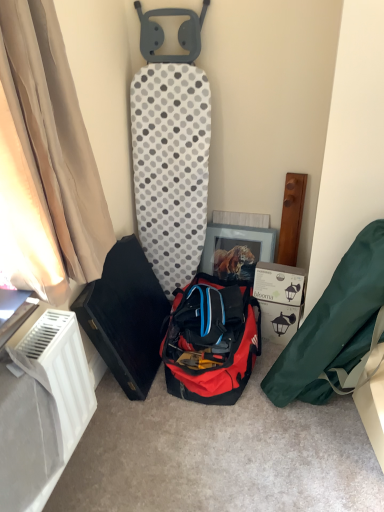
Question: Is beige fabric curtain at left located outside white plastic radiator at lower left?

Choices:
 (A) no
 (B) yes

Answer: (B)

Question: Is beige fabric curtain at left at the right side of white plastic radiator at lower left?

Choices:
 (A) yes
 (B) no

Answer: (A)

Question: Does beige fabric curtain at left touch white plastic radiator at lower left?

Choices:
 (A) yes
 (B) no

Answer: (B)

Question: Considering the relative sizes of beige fabric curtain at left and white plastic radiator at lower left in the image provided, is beige fabric curtain at left taller than white plastic radiator at lower left?

Choices:
 (A) yes
 (B) no

Answer: (A)

Question: Is beige fabric curtain at left wider than white plastic radiator at lower left?

Choices:
 (A) no
 (B) yes

Answer: (B)

Question: Is beige fabric curtain at left closer to camera compared to white plastic radiator at lower left?

Choices:
 (A) no
 (B) yes

Answer: (B)

Question: Is white cardboard box at lower right closer to camera compared to beige fabric curtain at left?

Choices:
 (A) yes
 (B) no

Answer: (B)

Question: Considering the relative positions of white cardboard box at lower right and beige fabric curtain at left in the image provided, is white cardboard box at lower right behind beige fabric curtain at left?

Choices:
 (A) no
 (B) yes

Answer: (B)

Question: From the image's perspective, is white cardboard box at lower right on top of beige fabric curtain at left?

Choices:
 (A) yes
 (B) no

Answer: (B)

Question: Would you say white cardboard box at lower right contains beige fabric curtain at left?

Choices:
 (A) no
 (B) yes

Answer: (A)

Question: Could you tell me if white cardboard box at lower right is facing beige fabric curtain at left?

Choices:
 (A) no
 (B) yes

Answer: (A)

Question: Can you confirm if white cardboard box at lower right is bigger than beige fabric curtain at left?

Choices:
 (A) yes
 (B) no

Answer: (B)

Question: Is white cardboard box at lower right further to camera compared to green fabric bag at lower right, arranged as the 2th kit when viewed from the left?

Choices:
 (A) no
 (B) yes

Answer: (B)